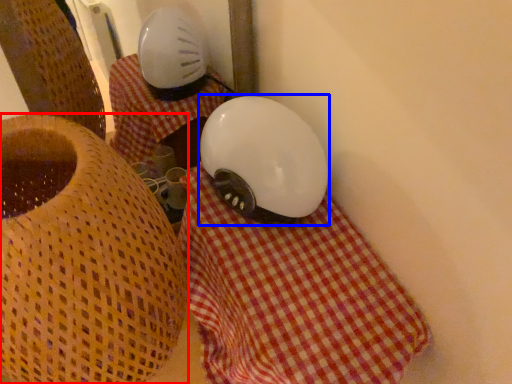
Question: Among these objects, which one is nearest to the camera, furniture (highlighted by a red box) or helmet (highlighted by a blue box)?

Choices:
 (A) furniture
 (B) helmet

Answer: (A)